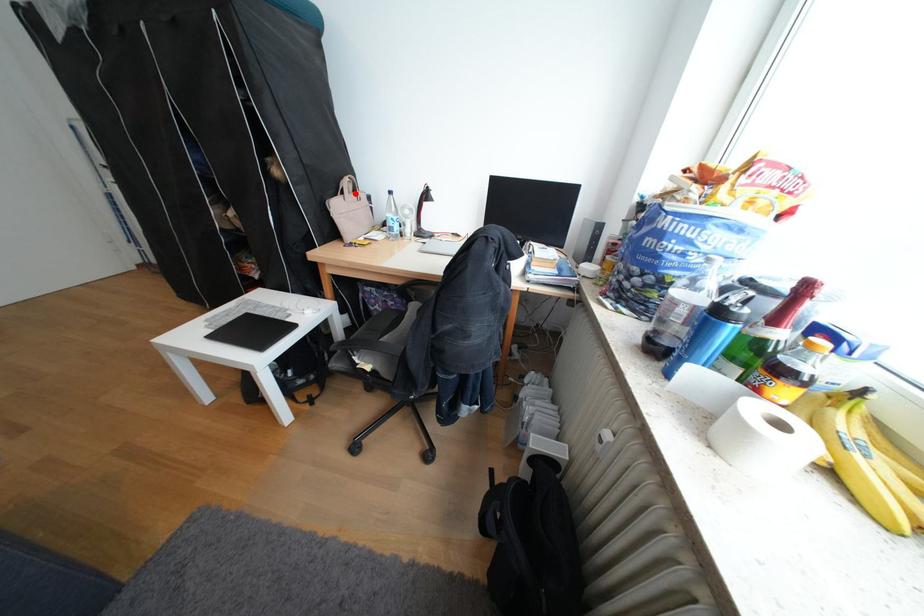
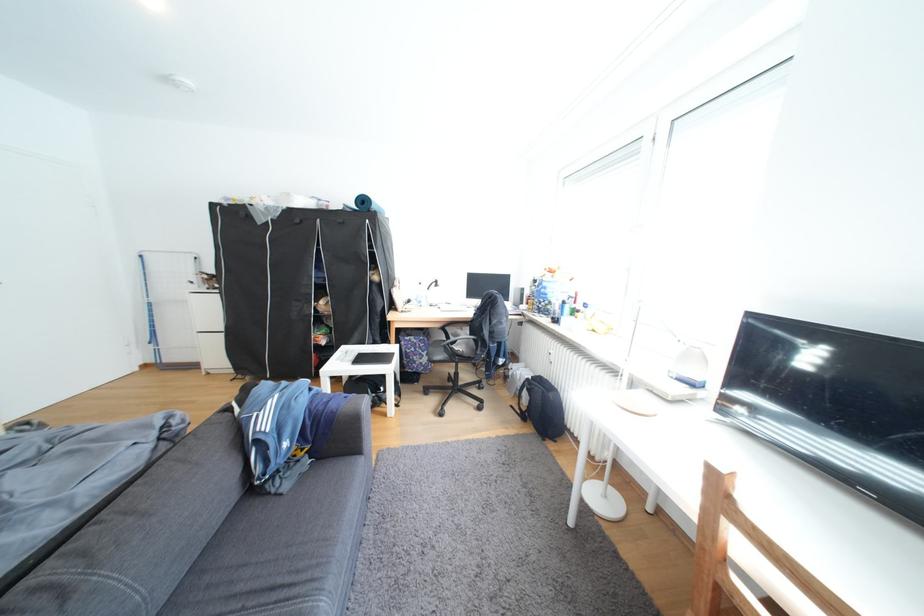
Question: I am providing you with two images of the same scene from different viewpoints. Image1 has a red point marked. In image2, the corresponding 3D location appears at what relative position? Reply with the corresponding letter.

Choices:
 (A) Closer
 (B) Farther

Answer: (B)